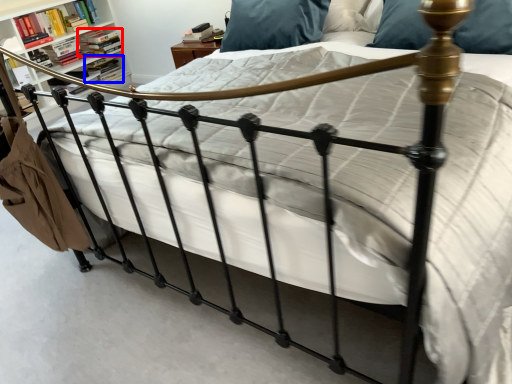
Question: Which point is further to the camera, book (highlighted by a red box) or book (highlighted by a blue box)?

Choices:
 (A) book
 (B) book

Answer: (B)